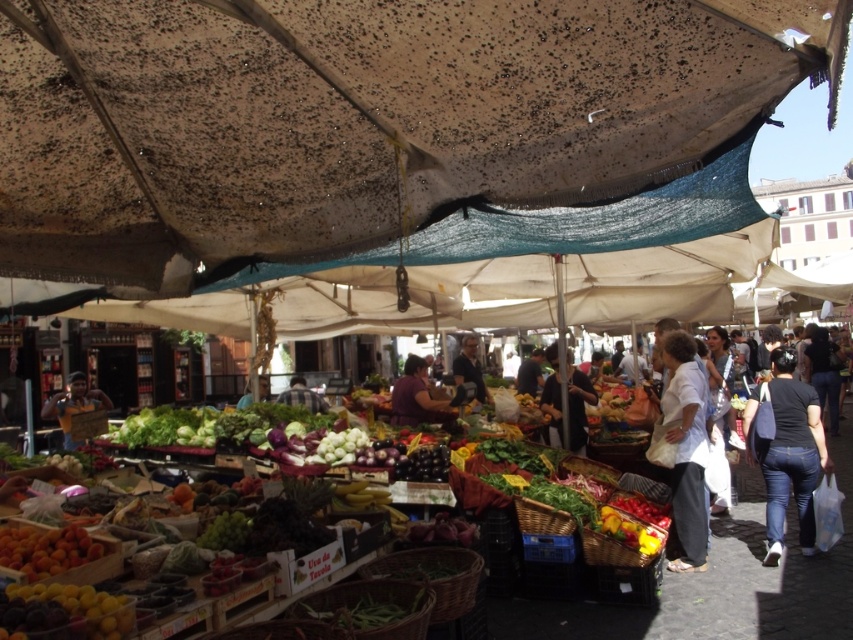
Can you confirm if yellow matte plums at lower left is thinner than dark fabric bag at center?

Correct, yellow matte plums at lower left's width is less than dark fabric bag at center's.

Between point (78, 586) and point (581, 422), which one is positioned behind?

Positioned behind is point (581, 422).

This screenshot has height=640, width=853. I want to click on yellow matte plums at lower left, so click(x=65, y=612).

Is brown fabric canopy at upper center thinner than matte yellow sign at center?

In fact, brown fabric canopy at upper center might be wider than matte yellow sign at center.

Between brown fabric canopy at upper center and matte yellow sign at center, which one has less height?

matte yellow sign at center

Locate an element on the screen. The height and width of the screenshot is (640, 853). brown fabric canopy at upper center is located at coordinates (358, 118).

Locate an element on the screen. brown fabric canopy at upper center is located at coordinates (358, 118).

Between point (663, 406) and point (410, 376), which one is positioned in front?

Positioned in front is point (663, 406).

Is white cotton shirt at center-right shorter than purple fabric at center?

No, white cotton shirt at center-right is not shorter than purple fabric at center.

Locate an element on the screen. white cotton shirt at center-right is located at coordinates (686, 448).